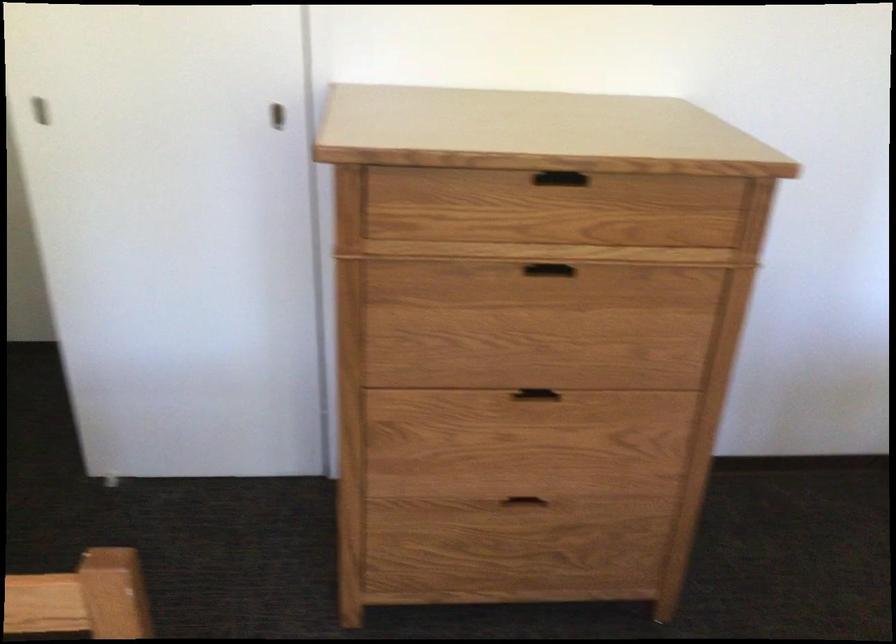
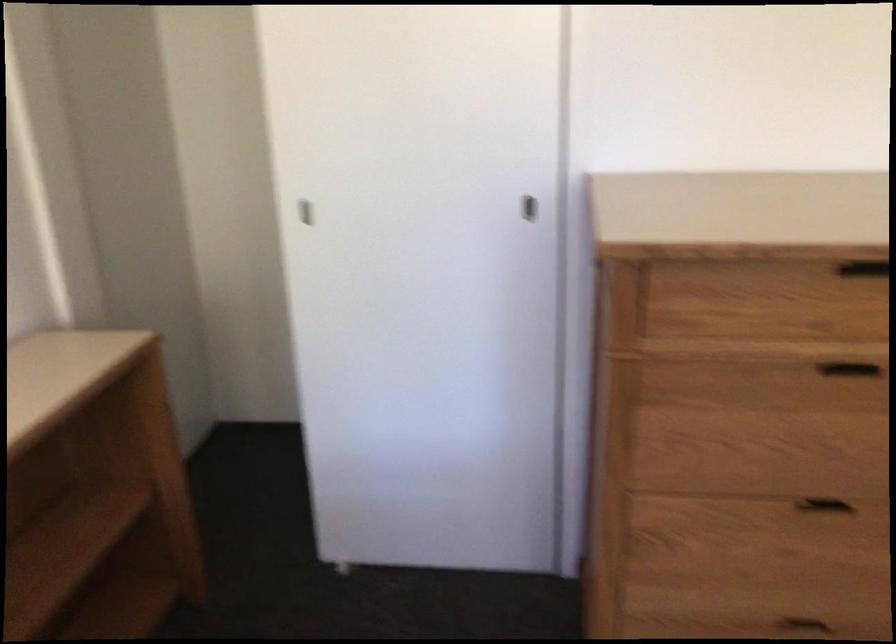
Question: The camera is either moving clockwise (left) or counter-clockwise (right) around the object. The first image is from the beginning of the video and the second image is from the end. Is the camera moving left or right when shooting the video?

Choices:
 (A) Left
 (B) Right

Answer: (B)